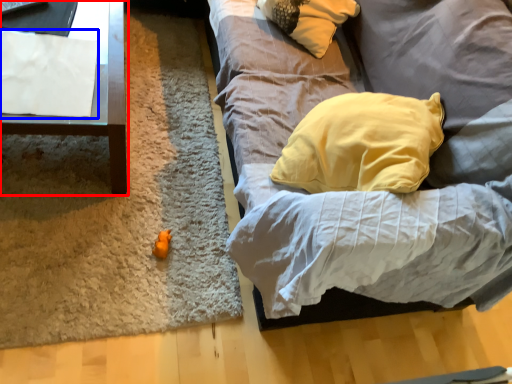
Question: Which of the following is the farthest to the observer, furniture (highlighted by a red box) or sheet (highlighted by a blue box)?

Choices:
 (A) furniture
 (B) sheet

Answer: (B)